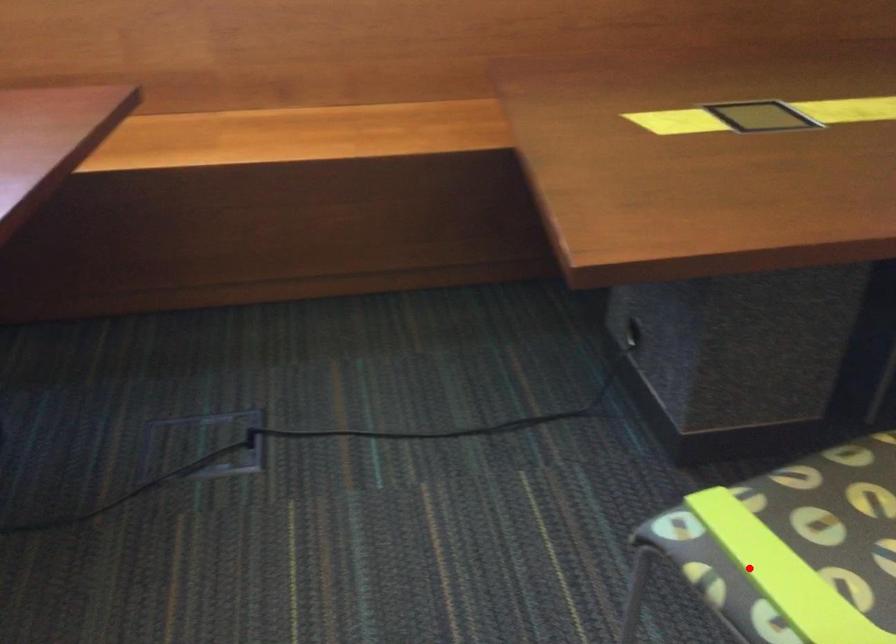
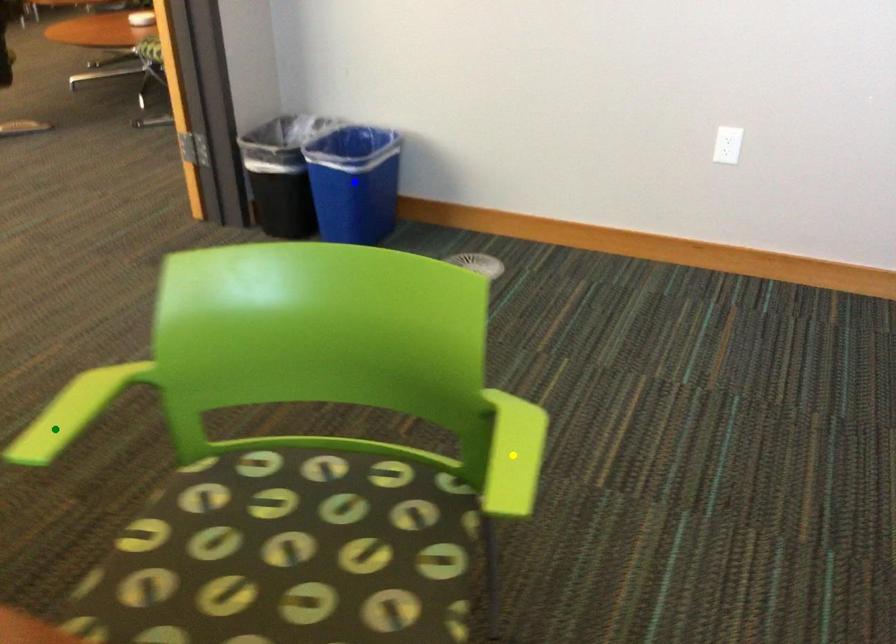
Question: I am providing you with two images of the same scene from different viewpoints. A red point is marked on the first image. You are given multiple points on the second image. In image 2, which mark is for the same physical point as the one in image 1?

Choices:
 (A) blue point
 (B) yellow point
 (C) green point

Answer: (B)